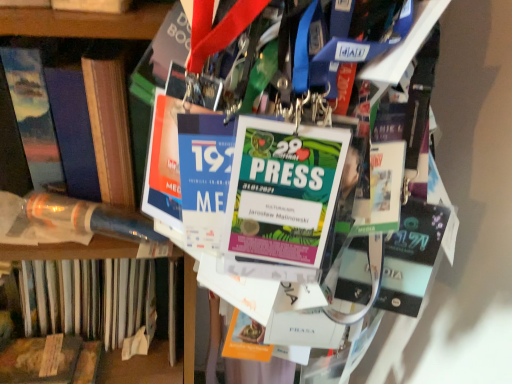
Question: Is hardcover book at left, arranged as the 4th book when viewed from the left, inside or outside of matte blue book at left, the 2th book in the right-to-left sequence?

Choices:
 (A) outside
 (B) inside

Answer: (A)

Question: From the image's perspective, is hardcover book at left, the first book when ordered from right to left, above or below matte blue book at left, positioned as the 3th book in left-to-right order?

Choices:
 (A) above
 (B) below

Answer: (B)

Question: Considering the real-world distances, which object is closest to the hardcover book at left, arranged as the 4th book when viewed from the left?

Choices:
 (A) wooden plank at lower left, arranged as the first book when viewed from the left
 (B) translucent plastic tube at left, which appears as the second book when viewed from the left
 (C) matte blue book at left, the 2th book in the right-to-left sequence

Answer: (C)

Question: Which is nearer to the wooden plank at lower left, arranged as the first book when viewed from the left?

Choices:
 (A) hardcover book at left, the first book when ordered from right to left
 (B) translucent plastic tube at left, the third book viewed from the right
 (C) matte blue book at left, positioned as the 3th book in left-to-right order

Answer: (B)